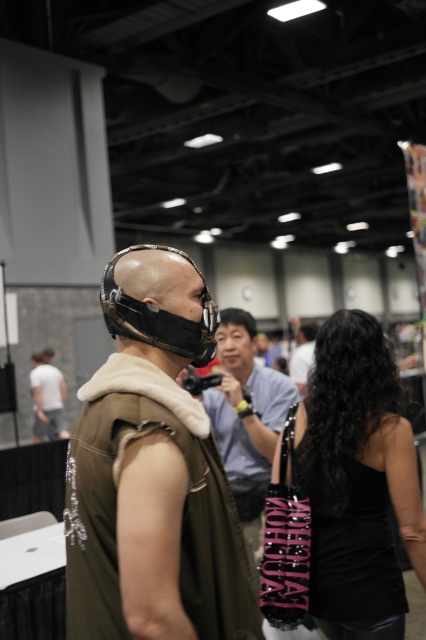
Is black matte/glossy goggles at upper left thinner than black matte vest at center?

Correct, black matte/glossy goggles at upper left's width is less than black matte vest at center's.

Can you confirm if black matte/glossy goggles at upper left is wider than black matte vest at center?

Incorrect, black matte/glossy goggles at upper left's width does not surpass black matte vest at center's.

Does point (207, 308) come in front of point (305, 337)?

Yes, point (207, 308) is closer to viewer.

Identify the location of black matte/glossy goggles at upper left. (158, 316).

Which is in front, point (97, 472) or point (178, 252)?

Point (97, 472) is more forward.

Can you confirm if leather-like brown vest at center is positioned above black matte/glossy goggles at upper left?

No, leather-like brown vest at center is not above black matte/glossy goggles at upper left.

Locate an element on the screen. leather-like brown vest at center is located at coordinates coord(152,484).

Locate an element on the screen. The height and width of the screenshot is (640, 426). leather-like brown vest at center is located at coordinates (152, 484).

In the scene shown: Between black leather bag at center and black matte/glossy goggles at upper left, which one appears on the left side from the viewer's perspective?

From the viewer's perspective, black matte/glossy goggles at upper left appears more on the left side.

Can you confirm if black leather bag at center is positioned to the left of black matte/glossy goggles at upper left?

Incorrect, black leather bag at center is not on the left side of black matte/glossy goggles at upper left.

Is point (385, 540) less distant than point (147, 342)?

No, (385, 540) is behind (147, 342).

Find the location of a particular element. The width and height of the screenshot is (426, 640). black leather bag at center is located at coordinates (342, 492).